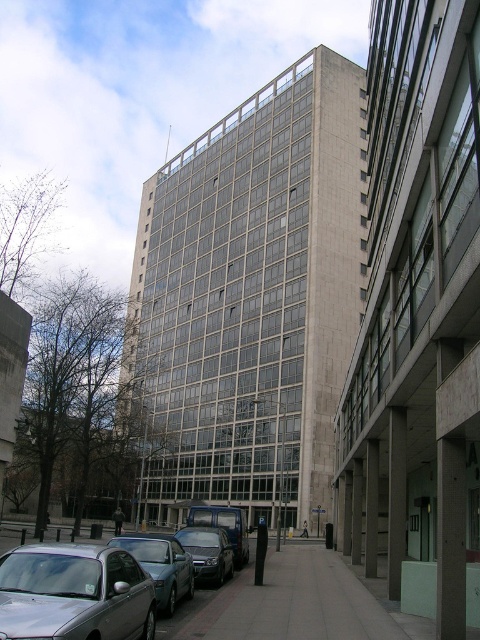
Can you confirm if silver metallic car at lower left is positioned below shiny black sedan at center?

Actually, silver metallic car at lower left is above shiny black sedan at center.

Does silver metallic car at lower left appear over shiny black sedan at center?

Correct, silver metallic car at lower left is located above shiny black sedan at center.

This screenshot has height=640, width=480. What are the coordinates of `silver metallic car at lower left` in the screenshot? It's located at (74, 593).

Does metallic silver car at lower left appear on the left side of shiny black sedan at center?

Yes, metallic silver car at lower left is to the left of shiny black sedan at center.

From the picture: Measure the distance between metallic silver car at lower left and shiny black sedan at center.

A distance of 3.02 meters exists between metallic silver car at lower left and shiny black sedan at center.

This screenshot has height=640, width=480. I want to click on metallic silver car at lower left, so click(x=162, y=564).

You are a GUI agent. You are given a task and a screenshot of the screen. Output one action in this format:
    pyautogui.click(x=<x>, y=<y>)
    Task: Click on the gray concrete pavement at lower center
    
    Given the screenshot: What is the action you would take?
    pyautogui.click(x=294, y=602)

The width and height of the screenshot is (480, 640). What are the coordinates of `gray concrete pavement at lower center` in the screenshot? It's located at (294, 602).

Locate an element on the screen. This screenshot has height=640, width=480. gray concrete pavement at lower center is located at coordinates (294, 602).